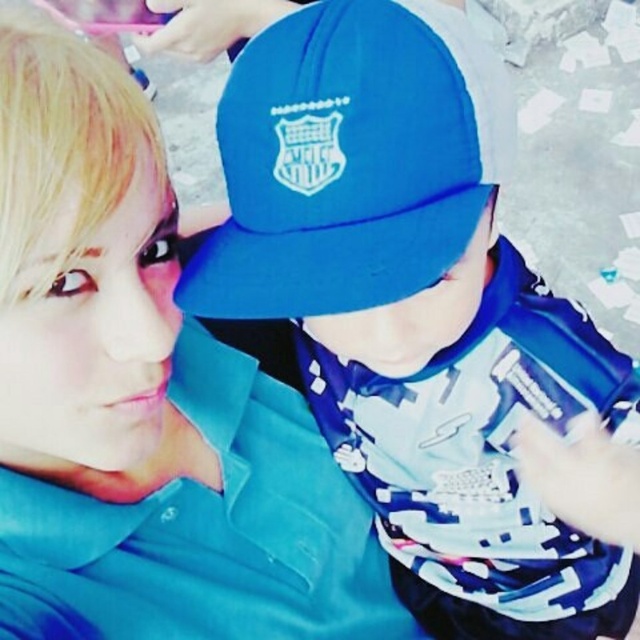
You are standing in the image and want to locate the matte blue cap at center. What are the coordinates where you can find it?

The matte blue cap at center can be found at coordinates point (413, 307).

You are a photographer trying to capture a candid shot of the person wearing the bright blue baseball cap with a white emblem. The cap is located at point (413, 307). Your camera has a rectangular frame that can only focus on objects within a specific area. If your camera frame is centered at point 0.5, 0.5 and has a width and height of 0.2 each, will the bright blue baseball cap with a white emblem be fully within the frame?

The bright blue baseball cap with a white emblem is represented by point (413, 307). The camera frame is centered at 0.5, 0.5 with a width and height of 0.2. The distance from the center to the edge horizontally is 0.1 and vertically is 0.1. The cap is at 0.481 on the x and 0.647 on the y. The x distance from center is 0.019 and y distance is 0.147. Both distances are within the 0.1 limit, so yes, the cap is fully within the frame.

You are a photographer trying to capture a clear shot of both the matte blue cap at center and the blue matte baseball cap at center in the image. Since you want to ensure both are visible, which cap should you focus on first to account for their sizes?

The matte blue cap at center is larger in width than the blue matte baseball cap at center, so you should focus on the matte blue cap at center first to ensure its details are captured clearly before adjusting for the smaller one.